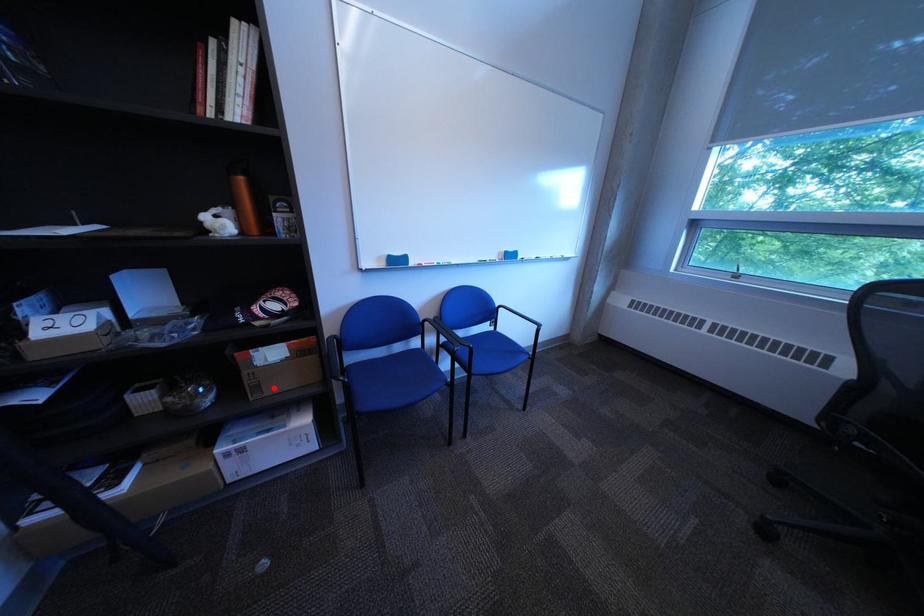
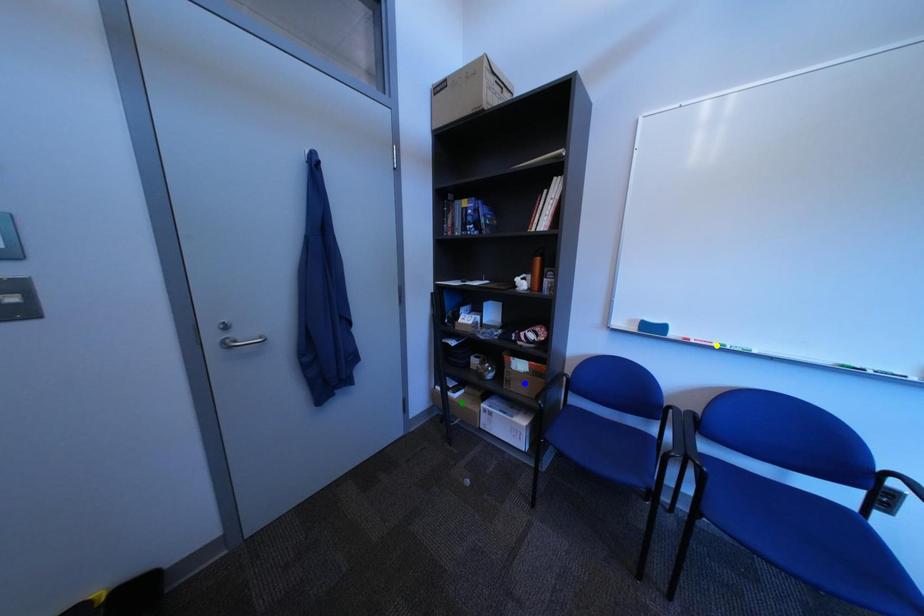
Question: I am providing you with two images of the same scene from different viewpoints. A red point is marked on the first image. You are given multiple points on the second image. Which point in image 2 represents the same 3d spot as the red point in image 1?

Choices:
 (A) yellow point
 (B) green point
 (C) blue point

Answer: (C)